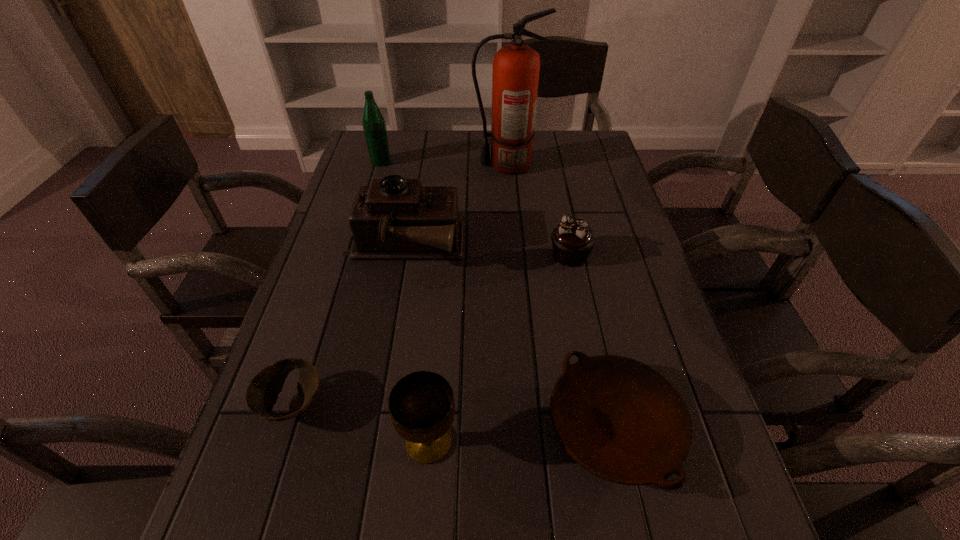
Where is `vacant region located on the front of the bottle`? vacant region located on the front of the bottle is located at coordinates (363, 222).

At what (x,y) coordinates should I click in order to perform the action: click on vacant region located on the horn of the third tallest object. Please return your answer as a coordinate pair (x, y). Looking at the image, I should click on (600, 247).

Identify the location of free location located 0.300m on the back of the fourth shortest object. (441, 296).

You are a GUI agent. You are given a task and a screenshot of the screen. Output one action in this format:
    pyautogui.click(x=<x>, y=<y>)
    Task: Click on the free space located 0.150m on the back of the cupcake
    Image resolution: width=960 pixels, height=540 pixels.
    Given the screenshot: What is the action you would take?
    pyautogui.click(x=560, y=207)

Locate an element on the screen. free space located on the front of the bowl is located at coordinates (256, 520).

You are a GUI agent. You are given a task and a screenshot of the screen. Output one action in this format:
    pyautogui.click(x=<x>, y=<y>)
    Task: Click on the vacant position located 0.280m on the back of the plate
    Image resolution: width=960 pixels, height=540 pixels.
    Given the screenshot: What is the action you would take?
    pyautogui.click(x=579, y=270)

This screenshot has width=960, height=540. In order to click on fire extinguisher that is at the far edge in this screenshot , I will do `click(515, 76)`.

Where is `bottle at the far edge`? The image size is (960, 540). bottle at the far edge is located at coordinates (374, 125).

The image size is (960, 540). Find the location of `bottle at the left edge`. bottle at the left edge is located at coordinates (374, 125).

The height and width of the screenshot is (540, 960). I want to click on phonograph_record at the left edge, so click(394, 218).